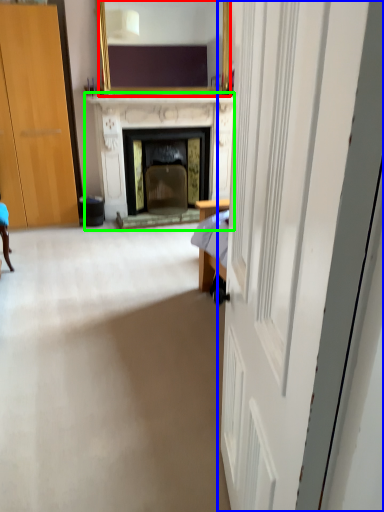
Question: Based on their relative distances, which object is nearer to mirror (highlighted by a red box)? Choose from door (highlighted by a blue box) and fireplace (highlighted by a green box).

Choices:
 (A) door
 (B) fireplace

Answer: (B)